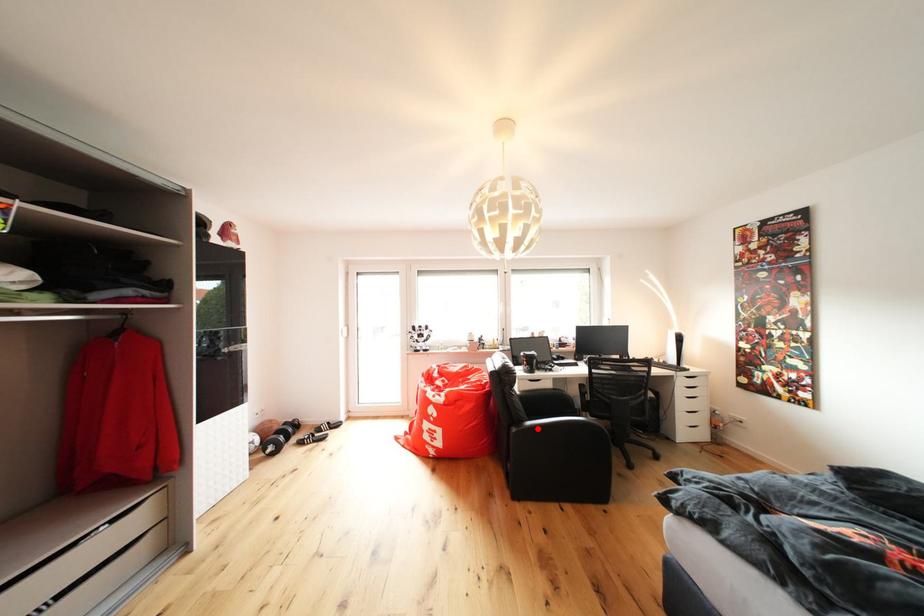
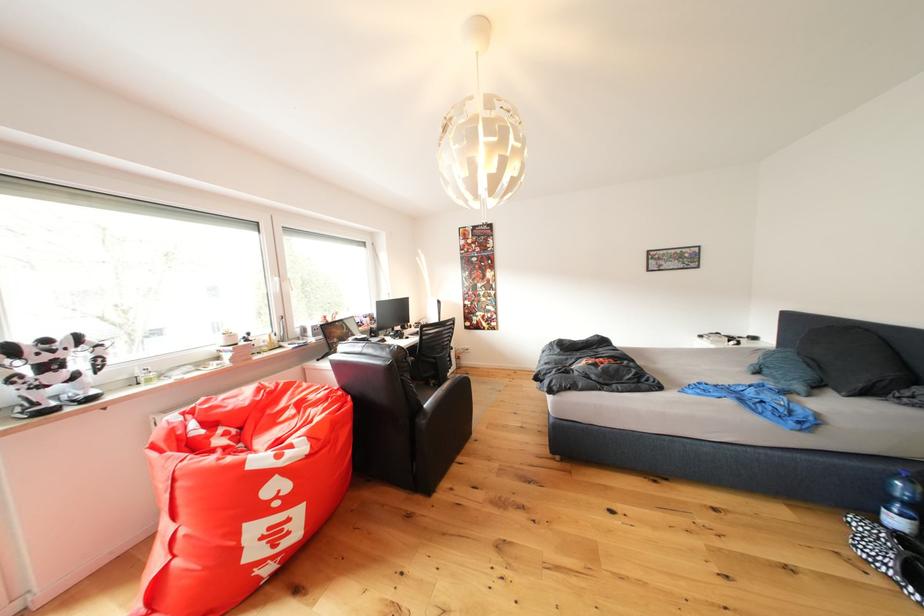
Question: I am providing you with two images of the same scene from different viewpoints. Given a red point in image1, look at the same physical point in image2. Is it:

Choices:
 (A) Closer to the viewpoint
 (B) Farther from the viewpoint

Answer: (A)